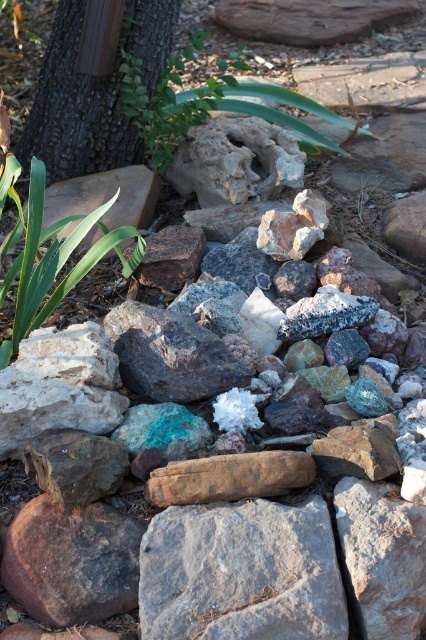
Can you confirm if green leafy plant at upper center is wider than green leafy plant at lower left?

Yes, green leafy plant at upper center is wider than green leafy plant at lower left.

Between point (219, 90) and point (114, 228), which one is positioned in front?

Point (114, 228)

Locate an element on the screen. green leafy plant at upper center is located at coordinates (207, 102).

Which of these two, gray rough rock at center or green leafy plant at lower left, stands taller?

green leafy plant at lower left is taller.

Between gray rough rock at center and green leafy plant at lower left, which one is positioned higher?

green leafy plant at lower left

Locate an element on the screen. The width and height of the screenshot is (426, 640). gray rough rock at center is located at coordinates (241, 573).

Where is `gray rough rock at center`? Image resolution: width=426 pixels, height=640 pixels. gray rough rock at center is located at coordinates (241, 573).

Which is above, brown rough rock at center or green leafy plant at upper center?

Positioned higher is green leafy plant at upper center.

At what (x,y) coordinates should I click in order to perform the action: click on brown rough rock at center. Please return your answer as a coordinate pair (x, y). The height and width of the screenshot is (640, 426). Looking at the image, I should click on (71, 561).

Locate an element on the screen. This screenshot has height=640, width=426. brown rough rock at center is located at coordinates (71, 561).